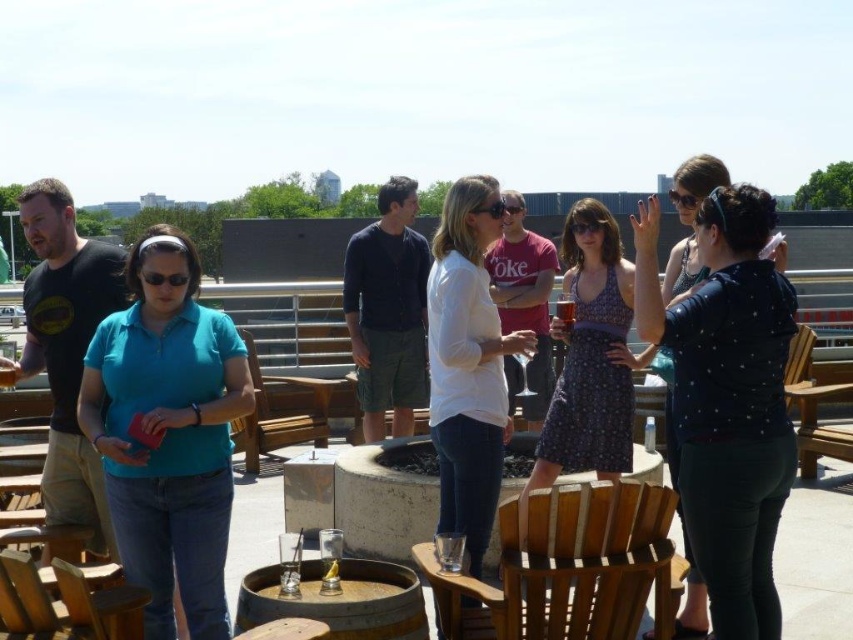
You are a photographer standing at the edge of the rooftop patio. You want to take a photo that includes both the matte black shirt at center and the patterned fabric dress at center. Which object should you focus on first to ensure both are in focus?

You should focus on the matte black shirt at center first because it is closer to the viewer than the patterned fabric dress at center, so adjusting focus from near to far will help both be in focus.

You are a delivery drone that is 1.5 meters wide. You need to deliver a package to the matte black shirt at center. There is a teal fabric shirt at left nearby. Can you fly between them without hitting either?

A: The distance between matte black shirt at center and teal fabric shirt at left is 2.26 meters, so the drone can safely fly through since its width of 1.5 meters is less than the 2.26 meters distance between them.

You are a photographer trying to capture a photo of the patterned fabric dress at center and the wooden chair at right. Which object should you focus on first if you want to include both in the frame without moving the camera?

The patterned fabric dress at center is smaller than the wooden chair at right, so you should focus on the wooden chair at right first to ensure it fits properly in the frame.